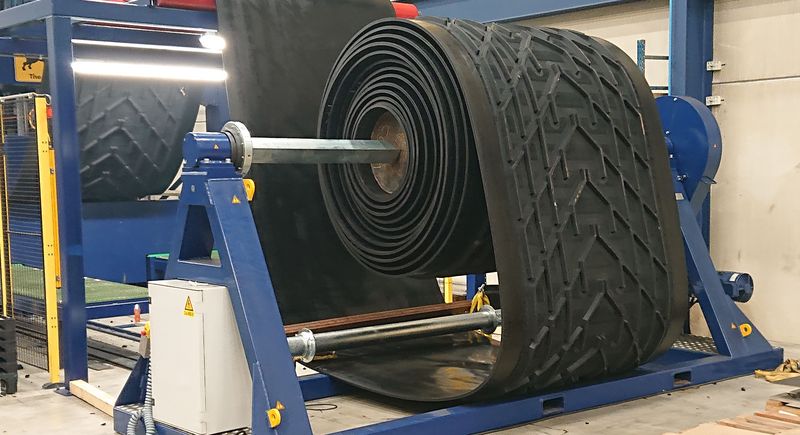
Locate an element on the screen. The image size is (800, 435). light is located at coordinates (208, 40).